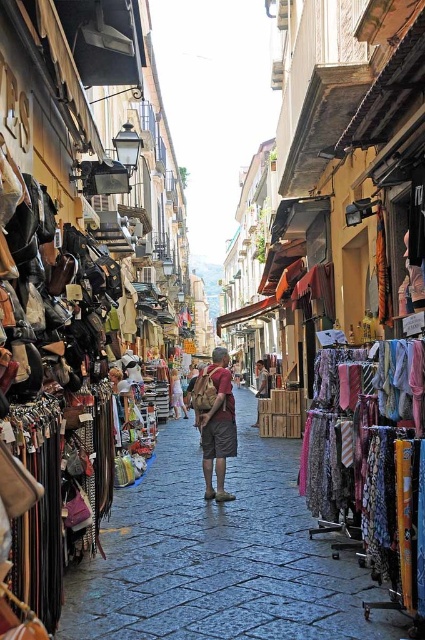
You are a customer browsing the stalls and shops on the cobblestone street. You see the denim shorts at center and the light brown leather backpack at center. Which item is positioned lower in the display?

The denim shorts at center is located below the light brown leather backpack at center, so it is positioned lower in the display.

You are a traveler with a 1.2 meters wide luggage cart. You want to pass through the narrow street between the denim shorts at center and the light brown leather backpack at center. Can your cart fit through the space between them?

The denim shorts at center is narrower than the light brown leather backpack at center, but the exact width of the space between them isn t specified. However, since the street itself is narrow, it s uncertain if the 1.2 meters wide cart can fit. Consider checking the available space or seeking an alternative route.